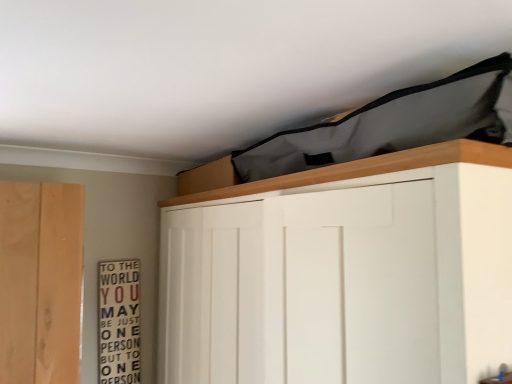
Describe the element at coordinates (343, 273) in the screenshot. I see `white matte cupboard at upper center` at that location.

Where is `white matte cupboard at upper center`? white matte cupboard at upper center is located at coordinates (343, 273).

Where is `wooden signboard at left`? The width and height of the screenshot is (512, 384). wooden signboard at left is located at coordinates (119, 322).

The width and height of the screenshot is (512, 384). What do you see at coordinates (119, 322) in the screenshot?
I see `wooden signboard at left` at bounding box center [119, 322].

In order to face wooden signboard at left, should I rotate leftwards or rightwards?

Turn left approximately 17.723 degrees to face it.

At what (x,y) coordinates should I click in order to perform the action: click on white matte cupboard at upper center. Please return your answer as a coordinate pair (x, y). Looking at the image, I should click on (343, 273).

Which is more to the left, wooden signboard at left or white matte cupboard at upper center?

wooden signboard at left.

Which object is more forward, wooden signboard at left or white matte cupboard at upper center?

white matte cupboard at upper center.

Considering the positions of points (106, 379) and (463, 179), is point (106, 379) closer to camera compared to point (463, 179)?

No, (106, 379) is behind (463, 179).

From the image's perspective, which object appears higher, wooden signboard at left or white matte cupboard at upper center?

white matte cupboard at upper center, from the image's perspective.

From a real-world perspective, is wooden signboard at left physically located above or below white matte cupboard at upper center?

wooden signboard at left is below white matte cupboard at upper center.

In the scene shown: Which of these two, wooden signboard at left or white matte cupboard at upper center, is wider?

With larger width is white matte cupboard at upper center.

Does wooden signboard at left have a greater height compared to white matte cupboard at upper center?

Incorrect, the height of wooden signboard at left is not larger of that of white matte cupboard at upper center.

Based on the photo, can you confirm if wooden signboard at left is bigger than white matte cupboard at upper center?

Incorrect, wooden signboard at left is not larger than white matte cupboard at upper center.

Do you think wooden signboard at left is within white matte cupboard at upper center, or outside of it?

The correct answer is: outside.

Is wooden signboard at left far away from white matte cupboard at upper center?

They are positioned close to each other.

Is wooden signboard at left positioned with its back to white matte cupboard at upper center?

No, wooden signboard at left is not facing the opposite direction of white matte cupboard at upper center.

Measure the distance between wooden signboard at left and white matte cupboard at upper center.

The distance of wooden signboard at left from white matte cupboard at upper center is 36.20 inches.

Where is `cupboard above the wooden signboard at left (from the image's perspective)`? cupboard above the wooden signboard at left (from the image's perspective) is located at coordinates (343, 273).

Is white matte cupboard at upper center to the left of wooden signboard at left from the viewer's perspective?

In fact, white matte cupboard at upper center is to the right of wooden signboard at left.

Is white matte cupboard at upper center positioned behind wooden signboard at left?

No.

Considering the points (444, 291) and (108, 343), which point is in front, point (444, 291) or point (108, 343)?

The point (444, 291) is closer.

From the image's perspective, would you say white matte cupboard at upper center is shown under wooden signboard at left?

No, from the image's perspective, white matte cupboard at upper center is not below wooden signboard at left.

In the scene shown: From a real-world perspective, which object rests below the other?

wooden signboard at left is physically lower.

Considering the relative sizes of white matte cupboard at upper center and wooden signboard at left in the image provided, is white matte cupboard at upper center wider than wooden signboard at left?

Yes.

Between white matte cupboard at upper center and wooden signboard at left, which one has more height?

With more height is white matte cupboard at upper center.

Looking at the image, does white matte cupboard at upper center seem bigger or smaller compared to wooden signboard at left?

Considering their sizes, white matte cupboard at upper center takes up more space than wooden signboard at left.

Is white matte cupboard at upper center positioned beyond the bounds of wooden signboard at left?

Yes.

Is white matte cupboard at upper center with wooden signboard at left?

white matte cupboard at upper center and wooden signboard at left are not in contact.

Is white matte cupboard at upper center facing towards wooden signboard at left?

Yes.

This screenshot has width=512, height=384. I want to click on bulletin board below the white matte cupboard at upper center (from the image's perspective), so click(x=119, y=322).

I want to click on cupboard in front of the wooden signboard at left, so click(343, 273).

Identify the location of cupboard located on the right of wooden signboard at left. The width and height of the screenshot is (512, 384). (343, 273).